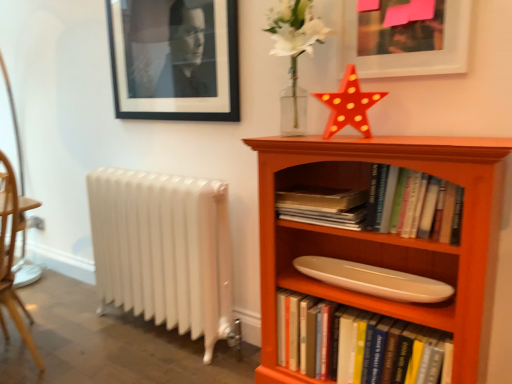
This screenshot has height=384, width=512. Find the location of `vacant space underneath white metallic radiator at lower left (from a real-world perspective)`. vacant space underneath white metallic radiator at lower left (from a real-world perspective) is located at coordinates (159, 337).